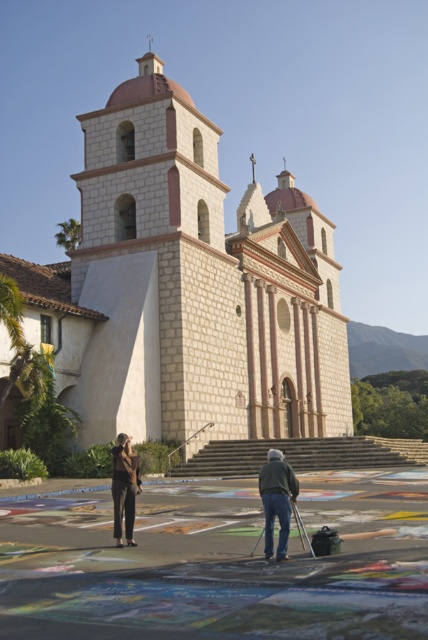
Question: Which point appears farthest from the camera in this image?

Choices:
 (A) tap(76, 316)
 (B) tap(282, 540)

Answer: (A)

Question: Which point appears closest to the camera in this image?

Choices:
 (A) (136, 467)
 (B) (278, 461)
 (C) (112, 272)

Answer: (B)

Question: Estimate the real-world distances between objects in this image. Which object is closer to the white stone church at center?

Choices:
 (A) matte black pants at lower left
 (B) denim jacket at lower center

Answer: (B)

Question: Is white stone church at center wider than denim jacket at lower center?

Choices:
 (A) no
 (B) yes

Answer: (B)

Question: Can you confirm if white stone church at center is thinner than dark gray jeans at center?

Choices:
 (A) no
 (B) yes

Answer: (A)

Question: Can you confirm if dark gray jeans at center is smaller than matte black pants at lower left?

Choices:
 (A) yes
 (B) no

Answer: (B)